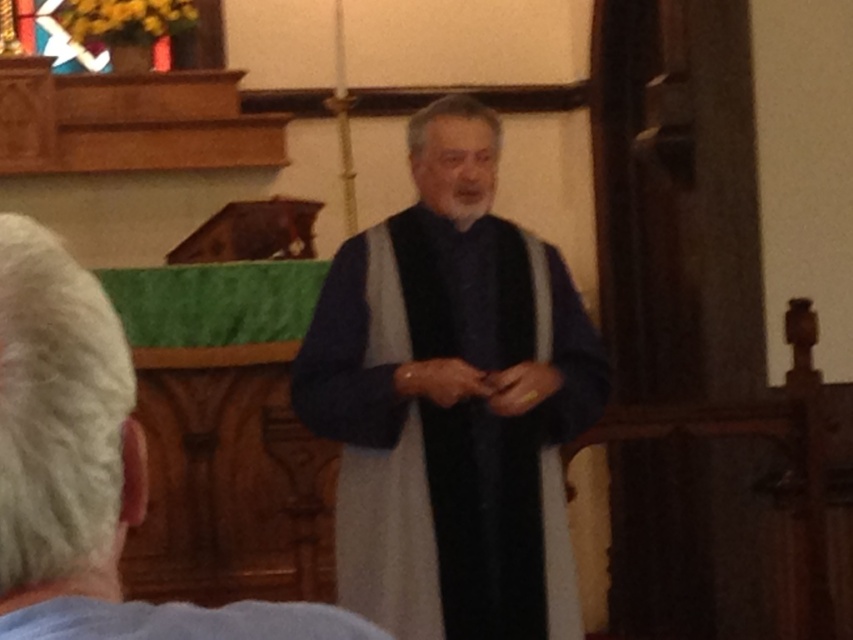
Question: Among these objects, which one is farthest from the camera?

Choices:
 (A) dark blue fabric at center
 (B) velvet blue robe at center

Answer: (B)

Question: Which point is farther to the camera?

Choices:
 (A) dark blue fabric at center
 (B) velvet blue robe at center

Answer: (B)

Question: Can you confirm if velvet blue robe at center is positioned to the right of dark blue fabric at center?

Choices:
 (A) no
 (B) yes

Answer: (B)

Question: Considering the relative positions of velvet blue robe at center and dark blue fabric at center in the image provided, where is velvet blue robe at center located with respect to dark blue fabric at center?

Choices:
 (A) left
 (B) right

Answer: (B)

Question: Can you confirm if velvet blue robe at center is positioned above dark blue fabric at center?

Choices:
 (A) no
 (B) yes

Answer: (B)